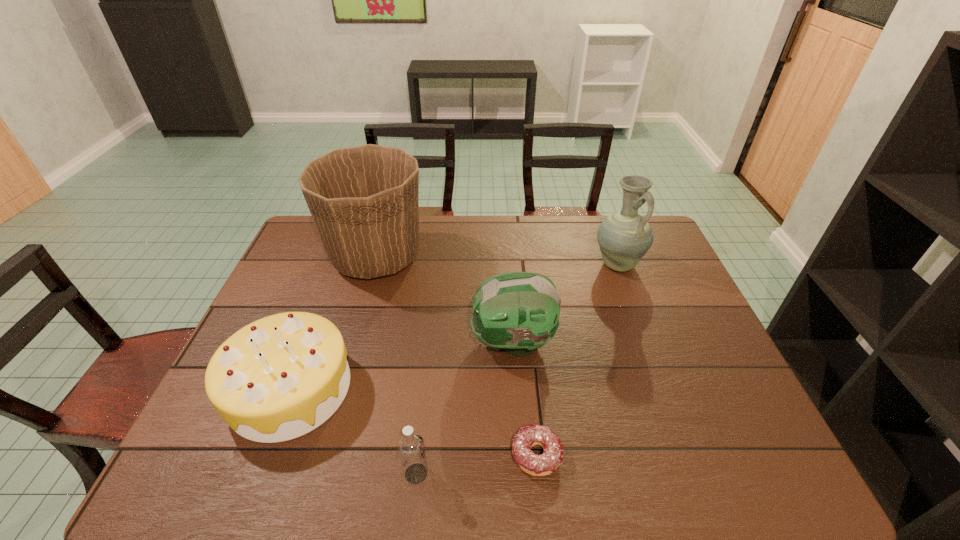
Identify the location of empty location between the doughnut and the birthday cake. The image size is (960, 540). (414, 422).

At what (x,y) coordinates should I click in order to perform the action: click on free space between the vodka and the flowerpot. Please return your answer as a coordinate pair (x, y). The image size is (960, 540). Looking at the image, I should click on (396, 366).

Where is `free space that is in between the fourth object from right to left and the flowerpot`? The image size is (960, 540). free space that is in between the fourth object from right to left and the flowerpot is located at coordinates (396, 366).

This screenshot has width=960, height=540. Identify the location of free space between the vodka and the pitcher. (516, 369).

Locate an element on the screen. This screenshot has height=540, width=960. free space between the fourth object from right to left and the birthday cake is located at coordinates (353, 431).

In order to click on vacant space in between the fourth object from right to left and the birthday cake in this screenshot , I will do `click(353, 431)`.

Where is `vacant point located between the football helmet and the doughnut`? This screenshot has width=960, height=540. vacant point located between the football helmet and the doughnut is located at coordinates (524, 398).

This screenshot has height=540, width=960. I want to click on free area in between the fourth shortest object and the third object from left to right, so click(x=465, y=408).

Identify which object is the fourth closest to the third object from left to right. Please provide its 2D coordinates. Your answer should be formatted as a tuple, i.e. [(x, y)], where the tuple contains the x and y coordinates of a point satisfying the conditions above.

[(363, 200)]

The height and width of the screenshot is (540, 960). Identify the location of object that ranks as the third closest to the vodka. (518, 311).